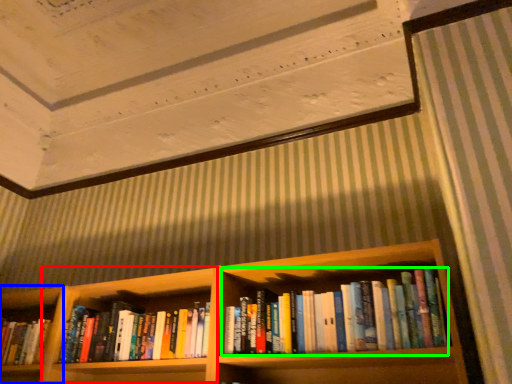
Question: Based on their relative distances, which object is farther from cabinet (highlighted by a red box)? Choose from shelf (highlighted by a blue box) and book (highlighted by a green box).

Choices:
 (A) shelf
 (B) book

Answer: (B)